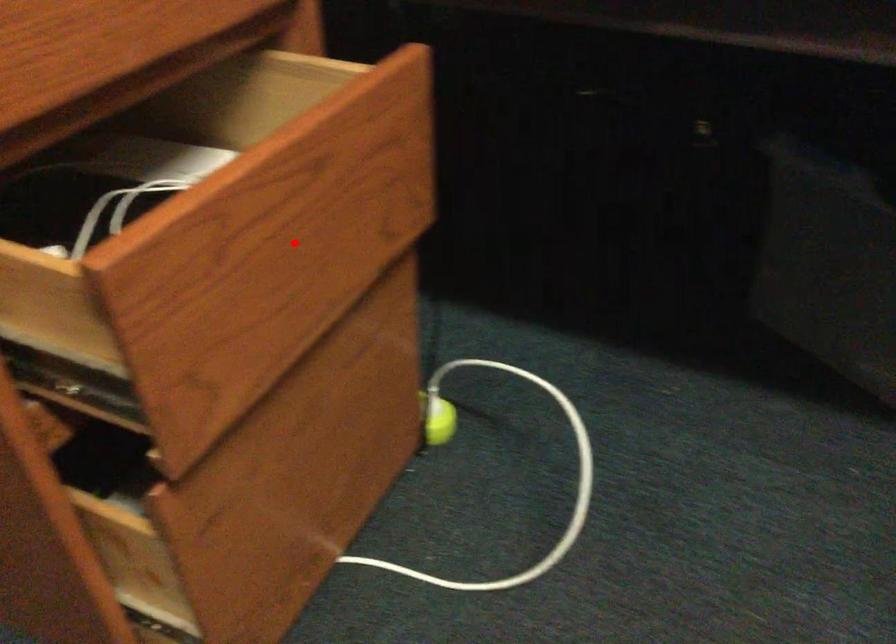
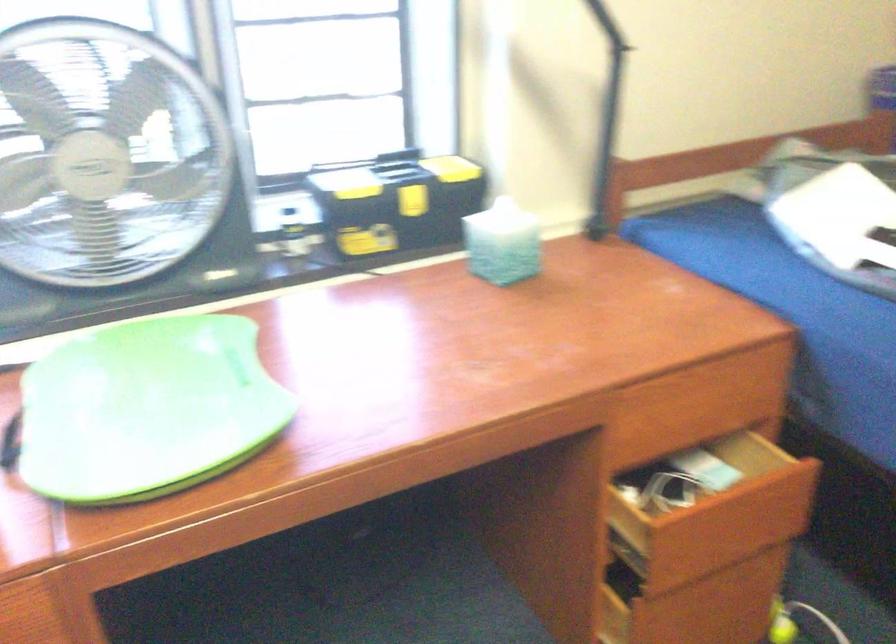
Question: I am providing you with two images of the same scene from different viewpoints. Image1 has a red point marked. In image2, the corresponding 3D location appears at what relative position? Reply with the corresponding letter.

Choices:
 (A) Closer
 (B) Farther

Answer: (B)